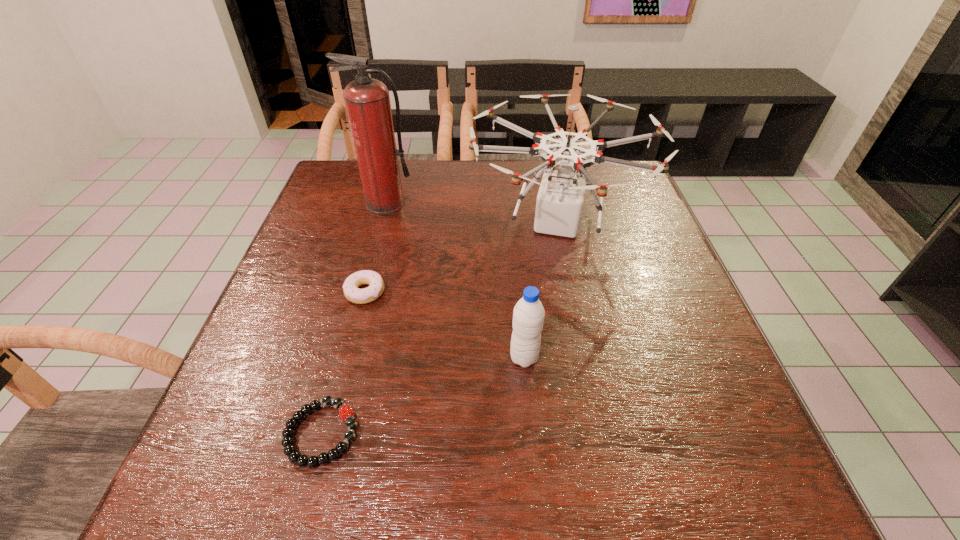
Where is `vacant area located on the front of the doughnut`? vacant area located on the front of the doughnut is located at coordinates (356, 325).

You are a GUI agent. You are given a task and a screenshot of the screen. Output one action in this format:
    pyautogui.click(x=<x>, y=<y>)
    Task: Click on the vacant region located on the right of the nearest object
    
    Given the screenshot: What is the action you would take?
    pyautogui.click(x=492, y=433)

What are the coordinates of `fire extinguisher positioned at the far edge` in the screenshot? It's located at (367, 100).

At what (x,y) coordinates should I click in order to perform the action: click on drone located at the far edge. Please return your answer as a coordinate pair (x, y). Looking at the image, I should click on (560, 198).

Image resolution: width=960 pixels, height=540 pixels. In order to click on object that is at the near edge in this screenshot , I will do `click(346, 413)`.

Where is `fire extinguisher at the left edge`? This screenshot has height=540, width=960. fire extinguisher at the left edge is located at coordinates (367, 100).

Locate an element on the screen. The width and height of the screenshot is (960, 540). doughnut located at the left edge is located at coordinates (351, 291).

I want to click on bracelet that is positioned at the left edge, so click(x=346, y=413).

You are a GUI agent. You are given a task and a screenshot of the screen. Output one action in this format:
    pyautogui.click(x=<x>, y=<y>)
    Task: Click on the object that is at the right edge
    
    Given the screenshot: What is the action you would take?
    pyautogui.click(x=560, y=198)

Locate an element on the screen. Image resolution: width=960 pixels, height=540 pixels. object located at the far left corner is located at coordinates (367, 100).